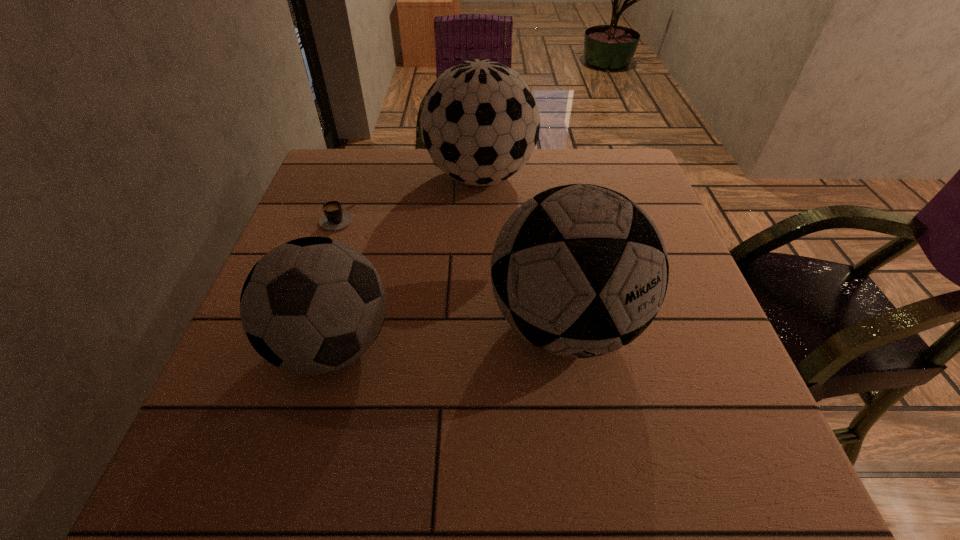
At what (x,y) coordinates should I click in order to perform the action: click on object present at the right edge. Please return your answer as a coordinate pair (x, y). This screenshot has width=960, height=540. Looking at the image, I should click on (579, 270).

In the image, there is a desktop. Where is `vacant space at the far edge`? vacant space at the far edge is located at coordinates (478, 187).

In the image, there is a desktop. Identify the location of vacant region at the near edge. (462, 492).

Where is `blank space at the left edge`? Image resolution: width=960 pixels, height=540 pixels. blank space at the left edge is located at coordinates (334, 237).

In the image, there is a desktop. Identify the location of vacant space at the right edge. The image size is (960, 540). (692, 352).

The image size is (960, 540). In order to click on vacant point at the far left corner in this screenshot , I will do `click(368, 159)`.

Image resolution: width=960 pixels, height=540 pixels. In order to click on free space at the near left corner of the desktop in this screenshot , I will do `click(297, 448)`.

In the image, there is a desktop. Find the location of `free region at the far right corner`. free region at the far right corner is located at coordinates (626, 194).

You are a GUI agent. You are given a task and a screenshot of the screen. Output one action in this format:
    pyautogui.click(x=<x>, y=<y>)
    Task: Click on the vacant space that's between the shortest object and the farthest soccer ball
    The width and height of the screenshot is (960, 540).
    Given the screenshot: What is the action you would take?
    pyautogui.click(x=409, y=197)

This screenshot has width=960, height=540. I want to click on vacant space that is in between the farthest soccer ball and the third tallest object, so click(x=406, y=261).